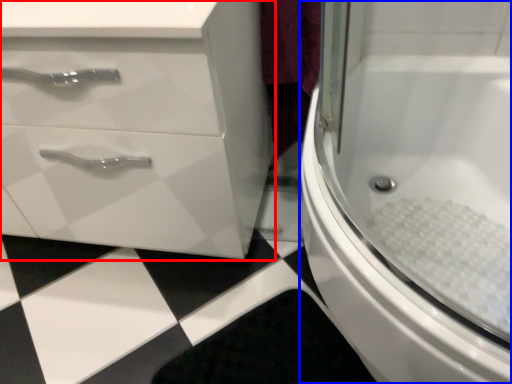
Question: Which of the following is the closest to the observer, bathroom cabinet (highlighted by a red box) or bath (highlighted by a blue box)?

Choices:
 (A) bathroom cabinet
 (B) bath

Answer: (B)